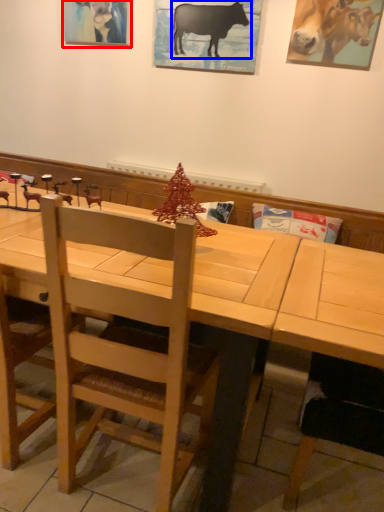
Question: Which point is closer to the camera, picture frame (highlighted by a red box) or cattle (highlighted by a blue box)?

Choices:
 (A) picture frame
 (B) cattle

Answer: (B)